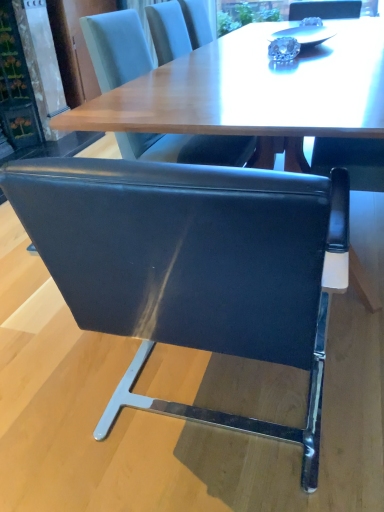
Question: Do you think black leather chair at center, the 2th chair in the right-to-left sequence, is within black leather chair at upper center, arranged as the second chair when viewed from the left, or outside of it?

Choices:
 (A) inside
 (B) outside

Answer: (B)

Question: Does point (112, 404) appear closer or farther from the camera than point (120, 44)?

Choices:
 (A) closer
 (B) farther

Answer: (A)

Question: Based on their sizes in the image, would you say black leather chair at center, which is the 1th chair from left to right, is bigger or smaller than black leather chair at upper center, which ranks as the first chair in right-to-left order?

Choices:
 (A) small
 (B) big

Answer: (B)

Question: Choose the correct answer: Is black leather chair at upper center, arranged as the second chair when viewed from the left, inside black leather chair at center, the 2th chair in the right-to-left sequence, or outside it?

Choices:
 (A) outside
 (B) inside

Answer: (A)

Question: Is black leather chair at upper center, arranged as the second chair when viewed from the left, bigger or smaller than black leather chair at center, which is the 1th chair from left to right?

Choices:
 (A) small
 (B) big

Answer: (A)

Question: Is black leather chair at upper center, which ranks as the first chair in right-to-left order, wider or thinner than black leather chair at center, which is the 1th chair from left to right?

Choices:
 (A) thin
 (B) wide

Answer: (A)

Question: Considering the positions of point (145, 157) and point (296, 322), is point (145, 157) closer or farther from the camera than point (296, 322)?

Choices:
 (A) farther
 (B) closer

Answer: (A)